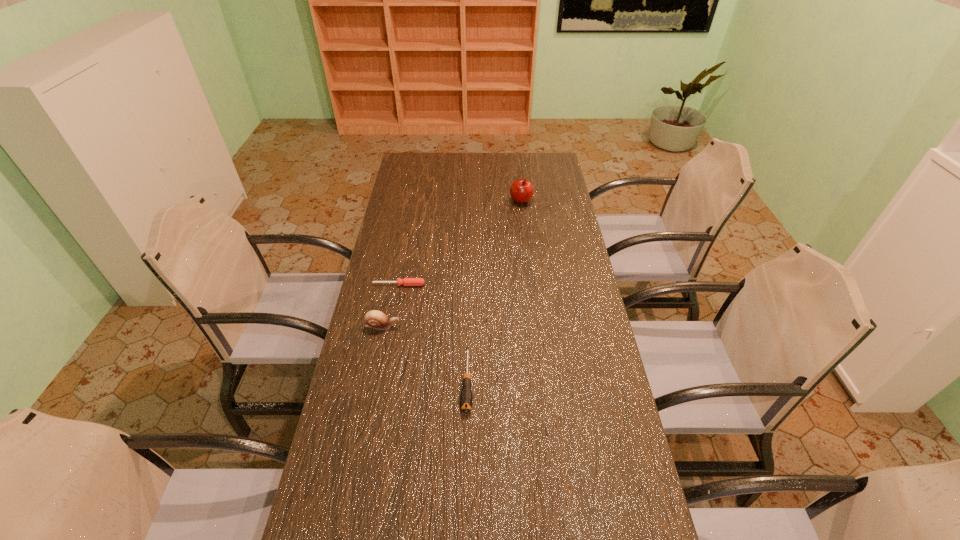
At what (x,y) coordinates should I click in order to perform the action: click on free space between the farther screwdriver and the escargot. Please return your answer as a coordinate pair (x, y). The image size is (960, 540). Looking at the image, I should click on (391, 305).

At what (x,y) coordinates should I click in order to perform the action: click on vacant point located between the shortest object and the nearest object. Please return your answer as a coordinate pair (x, y). The width and height of the screenshot is (960, 540). Looking at the image, I should click on (433, 332).

The height and width of the screenshot is (540, 960). I want to click on vacant region between the third shortest object and the second farthest object, so click(391, 305).

The height and width of the screenshot is (540, 960). I want to click on empty space that is in between the left screwdriver and the second nearest object, so click(x=391, y=305).

You are a GUI agent. You are given a task and a screenshot of the screen. Output one action in this format:
    pyautogui.click(x=<x>, y=<y>)
    Task: Click on the unoccupied position between the second nearest object and the shorter screwdriver
    
    Given the screenshot: What is the action you would take?
    pyautogui.click(x=391, y=305)

The height and width of the screenshot is (540, 960). I want to click on free spot between the taller screwdriver and the second tallest object, so click(425, 353).

This screenshot has width=960, height=540. Find the location of `free space between the apple and the farther screwdriver`. free space between the apple and the farther screwdriver is located at coordinates (460, 242).

Where is `vacant area that lies between the left screwdriver and the farthest object`? vacant area that lies between the left screwdriver and the farthest object is located at coordinates (460, 242).

You are a GUI agent. You are given a task and a screenshot of the screen. Output one action in this format:
    pyautogui.click(x=<x>, y=<y>)
    Task: Click on the vacant point located between the farthest object and the left screwdriver
    
    Given the screenshot: What is the action you would take?
    pyautogui.click(x=460, y=242)

This screenshot has height=540, width=960. In order to click on vacant area that lies between the tallest object and the nearer screwdriver in this screenshot , I will do `click(494, 291)`.